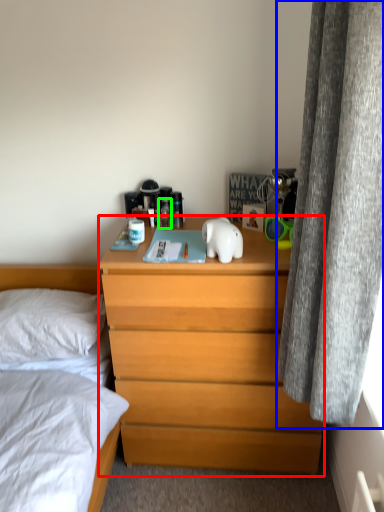
Question: Estimate the real-world distances between objects in this image. Which object is farther from chest of drawers (highlighted by a red box), curtain (highlighted by a blue box) or toiletry (highlighted by a green box)?

Choices:
 (A) curtain
 (B) toiletry

Answer: (B)